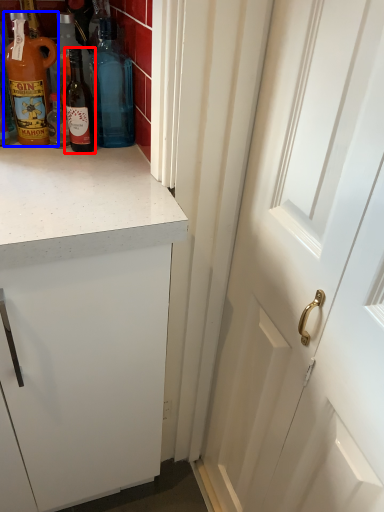
Question: Among these objects, which one is nearest to the camera, bottle (highlighted by a red box) or bottle (highlighted by a blue box)?

Choices:
 (A) bottle
 (B) bottle

Answer: (B)